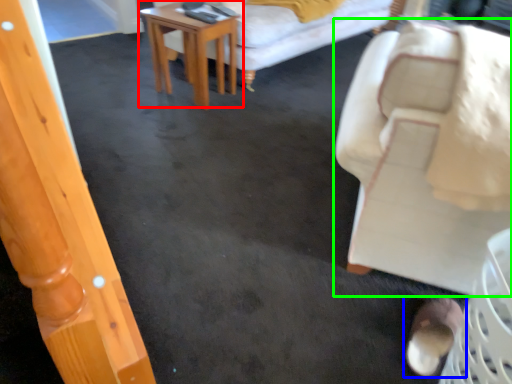
Question: Estimate the real-world distances between objects in this image. Which object is farther from table (highlighted by a red box), footwear (highlighted by a blue box) or chair (highlighted by a green box)?

Choices:
 (A) footwear
 (B) chair

Answer: (A)